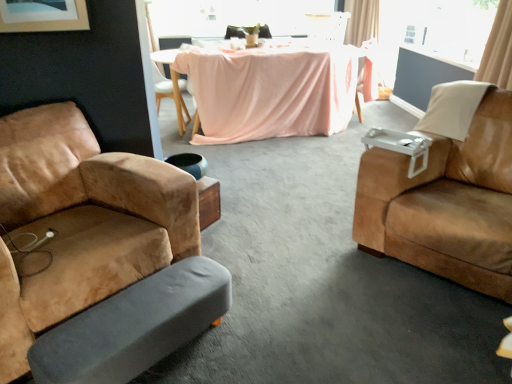
Question: Is suede tan armchair at left, arranged as the fourth chair when viewed from the back, looking in the opposite direction of matte pink fabric chair at center, which is the 1th chair in back-to-front order?

Choices:
 (A) yes
 (B) no

Answer: (B)

Question: Can matte pink fabric chair at center, which is the 1th chair in back-to-front order, be found inside suede tan armchair at left, the second chair when ordered from left to right?

Choices:
 (A) no
 (B) yes

Answer: (A)

Question: Can you confirm if suede tan armchair at left, placed as the 3th chair when sorted from right to left, is shorter than matte pink fabric chair at center, which is the 4th chair in left-to-right order?

Choices:
 (A) yes
 (B) no

Answer: (B)

Question: Does suede tan armchair at left, placed as the 3th chair when sorted from right to left, have a lesser width compared to matte pink fabric chair at center, which appears as the first chair when viewed from the right?

Choices:
 (A) no
 (B) yes

Answer: (A)

Question: Is suede tan armchair at left, arranged as the fourth chair when viewed from the back, bigger than matte pink fabric chair at center, which appears as the first chair when viewed from the right?

Choices:
 (A) yes
 (B) no

Answer: (A)

Question: Considering the relative sizes of suede tan armchair at left, the second chair when ordered from left to right, and matte pink fabric chair at center, arranged as the fourth chair when viewed from the front, in the image provided, is suede tan armchair at left, the second chair when ordered from left to right, smaller than matte pink fabric chair at center, arranged as the fourth chair when viewed from the front,?

Choices:
 (A) no
 (B) yes

Answer: (A)

Question: Is pink fabric-covered table at center wider than gray fabric footrest at lower left?

Choices:
 (A) no
 (B) yes

Answer: (B)

Question: Does pink fabric-covered table at center have a greater height compared to gray fabric footrest at lower left?

Choices:
 (A) no
 (B) yes

Answer: (B)

Question: Would you say pink fabric-covered table at center contains gray fabric footrest at lower left?

Choices:
 (A) no
 (B) yes

Answer: (A)

Question: Considering the relative sizes of pink fabric-covered table at center and gray fabric footrest at lower left in the image provided, is pink fabric-covered table at center thinner than gray fabric footrest at lower left?

Choices:
 (A) no
 (B) yes

Answer: (A)

Question: Can you confirm if pink fabric-covered table at center is shorter than gray fabric footrest at lower left?

Choices:
 (A) yes
 (B) no

Answer: (B)

Question: Can you confirm if pink fabric-covered table at center is smaller than gray fabric footrest at lower left?

Choices:
 (A) no
 (B) yes

Answer: (A)

Question: Is pink fabric-covered table at center completely or partially outside of white glossy armchair at upper center?

Choices:
 (A) yes
 (B) no

Answer: (A)